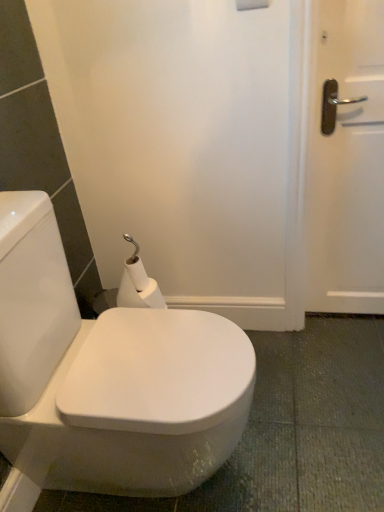
The width and height of the screenshot is (384, 512). Describe the element at coordinates (138, 287) in the screenshot. I see `white matte toilet paper at center` at that location.

Identify the location of white matte toilet paper at center. (138, 287).

Identify the location of white glossy bidet at center. (138, 405).

Describe the element at coordinates (138, 405) in the screenshot. The width and height of the screenshot is (384, 512). I see `white glossy bidet at center` at that location.

Where is `white matte toilet paper at center`? white matte toilet paper at center is located at coordinates (138, 287).

Is white matte toilet paper at center at the right side of white glossy bidet at center?

No.

From the picture: Does white matte toilet paper at center come in front of white glossy bidet at center?

No, the depth of white matte toilet paper at center is greater than that of white glossy bidet at center.

Considering the points (123, 278) and (217, 411), which point is in front, point (123, 278) or point (217, 411)?

The point (217, 411) is in front.

From the image's perspective, is white matte toilet paper at center under white glossy bidet at center?

Incorrect, from the image's perspective, white matte toilet paper at center is higher than white glossy bidet at center.

From a real-world perspective, between white matte toilet paper at center and white glossy bidet at center, who is vertically higher?

white matte toilet paper at center is physically above.

Can you confirm if white matte toilet paper at center is wider than white glossy bidet at center?

No, white matte toilet paper at center is not wider than white glossy bidet at center.

In terms of height, does white matte toilet paper at center look taller or shorter compared to white glossy bidet at center?

In the image, white matte toilet paper at center appears to be shorter than white glossy bidet at center.

Considering the relative sizes of white matte toilet paper at center and white glossy bidet at center in the image provided, is white matte toilet paper at center bigger than white glossy bidet at center?

No, white matte toilet paper at center is not bigger than white glossy bidet at center.

Is white matte toilet paper at center not inside white glossy bidet at center?

white matte toilet paper at center lies outside white glossy bidet at center's area.

Is white matte toilet paper at center in contact with white glossy bidet at center?

No, white matte toilet paper at center is not next to white glossy bidet at center.

Is white matte toilet paper at center facing towards white glossy bidet at center?

Yes, white matte toilet paper at center is turned towards white glossy bidet at center.

How far apart are white matte toilet paper at center and white glossy bidet at center?

They are 13.88 inches apart.

Where is `toilet paper that is on the left side of white glossy bidet at center`? Image resolution: width=384 pixels, height=512 pixels. toilet paper that is on the left side of white glossy bidet at center is located at coordinates (138, 287).

Based on their positions, is white glossy bidet at center located to the left or right of white matte toilet paper at center?

In the image, white glossy bidet at center appears on the right side of white matte toilet paper at center.

Is the position of white glossy bidet at center less distant than that of white matte toilet paper at center?

Yes, white glossy bidet at center is closer to the camera.

Which point is more forward, (59, 417) or (127, 279)?

Point (59, 417)

From the image's perspective, is white glossy bidet at center located beneath white matte toilet paper at center?

Indeed, from the image's perspective, white glossy bidet at center is shown beneath white matte toilet paper at center.

From a real-world perspective, which object stands above the other?

In real-world perspective, white matte toilet paper at center is above.

Which of these two, white glossy bidet at center or white matte toilet paper at center, is thinner?

With smaller width is white matte toilet paper at center.

Consider the image. Can you confirm if white glossy bidet at center is shorter than white matte toilet paper at center?

Incorrect, the height of white glossy bidet at center does not fall short of that of white matte toilet paper at center.

Between white glossy bidet at center and white matte toilet paper at center, which one has larger size?

white glossy bidet at center.

Is white glossy bidet at center positioned beyond the bounds of white matte toilet paper at center?

Yes, white glossy bidet at center is not within white matte toilet paper at center.

Is white glossy bidet at center touching white matte toilet paper at center?

They are not placed beside each other.

Is white glossy bidet at center facing away from white matte toilet paper at center?

No, white glossy bidet at center is not facing away from white matte toilet paper at center.

How many degrees apart are the facing directions of white glossy bidet at center and white matte toilet paper at center?

89.9 degrees.

How distant is white glossy bidet at center from white matte toilet paper at center?

13.88 inches.

You are a GUI agent. You are given a task and a screenshot of the screen. Output one action in this format:
    pyautogui.click(x=<x>, y=<y>)
    Task: Click on the toilet paper on the left of white glossy bidet at center
    This screenshot has width=384, height=512.
    Given the screenshot: What is the action you would take?
    pyautogui.click(x=138, y=287)

At what (x,y) coordinates should I click in order to perform the action: click on toilet paper behind the white glossy bidet at center. Please return your answer as a coordinate pair (x, y). The height and width of the screenshot is (512, 384). Looking at the image, I should click on (138, 287).

The image size is (384, 512). I want to click on bidet in front of the white matte toilet paper at center, so click(x=138, y=405).